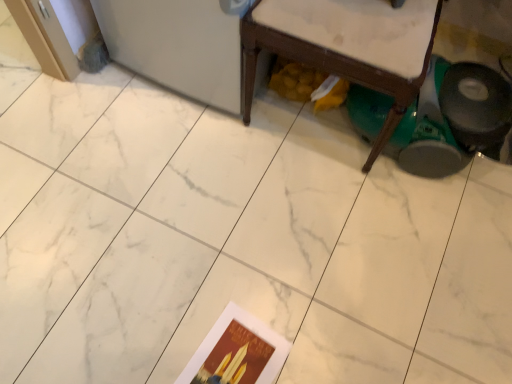
Question: Is point (227, 337) positioned closer to the camera than point (359, 69)?

Choices:
 (A) closer
 (B) farther

Answer: (B)

Question: From the image's perspective, is matte paper postcard at lower center located above or below wooden chair at lower right?

Choices:
 (A) above
 (B) below

Answer: (B)

Question: From their relative heights in the image, would you say matte paper postcard at lower center is taller or shorter than wooden chair at lower right?

Choices:
 (A) tall
 (B) short

Answer: (B)

Question: Considering the positions of wooden chair at lower right and matte paper postcard at lower center in the image, is wooden chair at lower right taller or shorter than matte paper postcard at lower center?

Choices:
 (A) short
 (B) tall

Answer: (B)

Question: Would you say wooden chair at lower right is inside or outside matte paper postcard at lower center?

Choices:
 (A) outside
 (B) inside

Answer: (A)

Question: Relative to matte paper postcard at lower center, is wooden chair at lower right in front or behind?

Choices:
 (A) front
 (B) behind

Answer: (A)

Question: From the image's perspective, is wooden chair at lower right above or below matte paper postcard at lower center?

Choices:
 (A) above
 (B) below

Answer: (A)